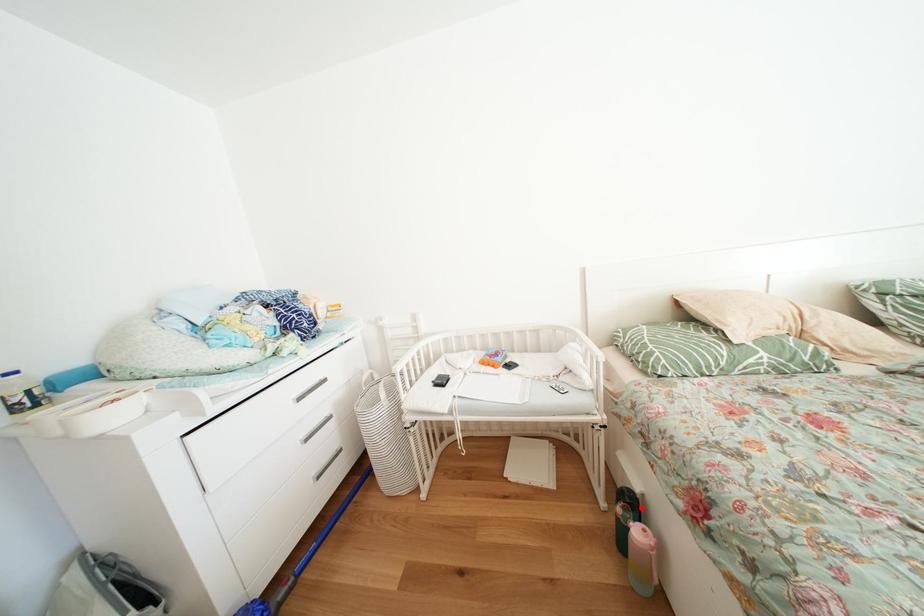
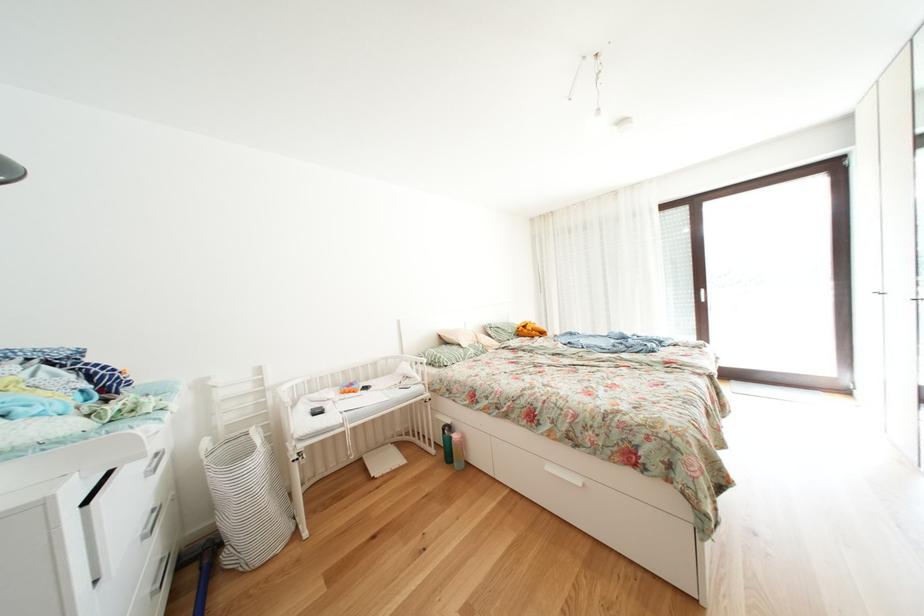
In the second image, find the point that corresponds to the highlighted location in the first image.

(458, 432)